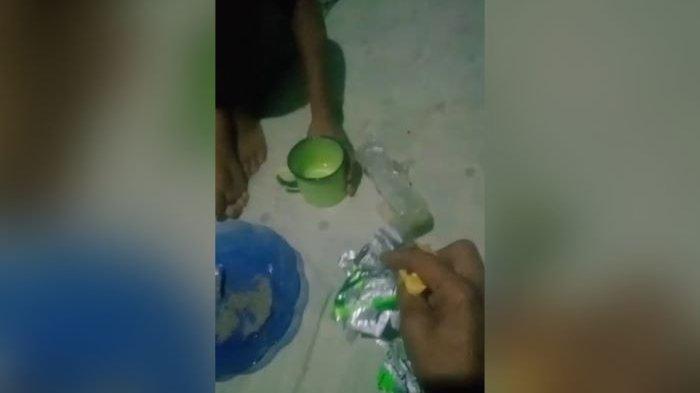
The height and width of the screenshot is (393, 700). In order to click on inside of cup in this screenshot , I will do `click(312, 170)`.